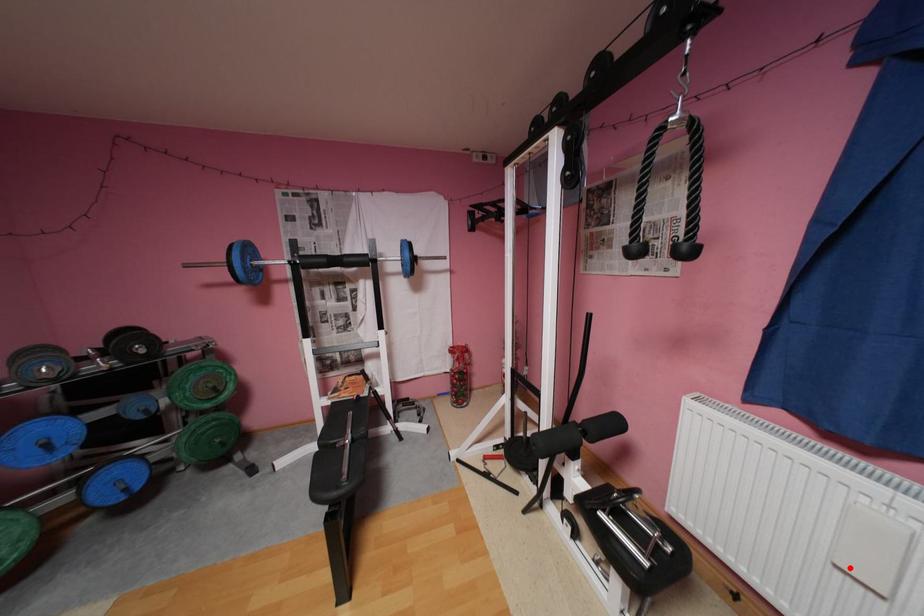
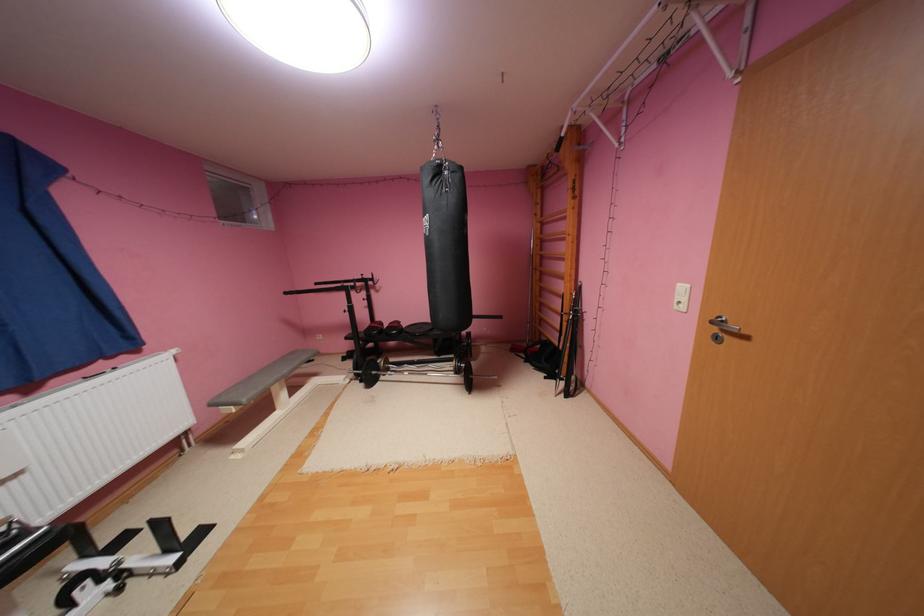
Question: I am providing you with two images of the same scene from different viewpoints. Given a red point in image1, look at the same physical point in image2. Is it:

Choices:
 (A) Closer to the viewpoint
 (B) Farther from the viewpoint

Answer: (B)